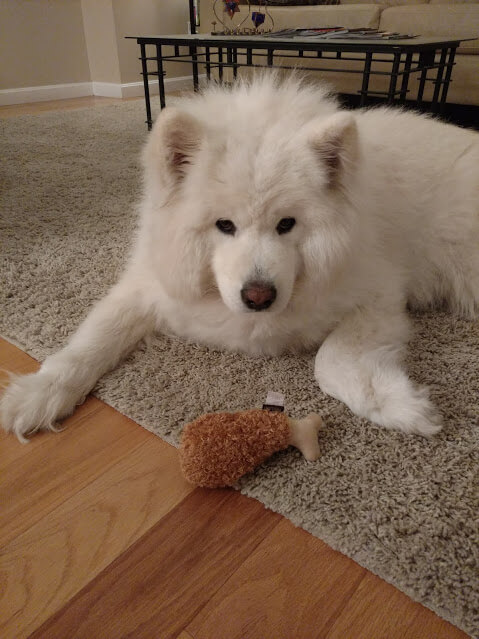
The width and height of the screenshot is (479, 639). I want to click on blue lamp on table, so click(258, 19).